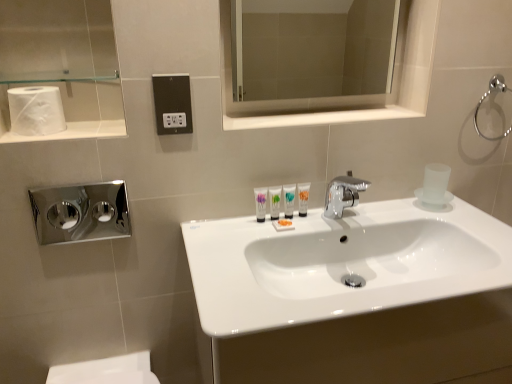
At what (x,y) coordinates should I click in order to perform the action: click on free space between white glossy tube at center, arranged as the second toiletry when viewed from the right, and polished chrome faucet at center. Please return your answer as a coordinate pair (x, y). This screenshot has width=512, height=384. Looking at the image, I should click on (302, 223).